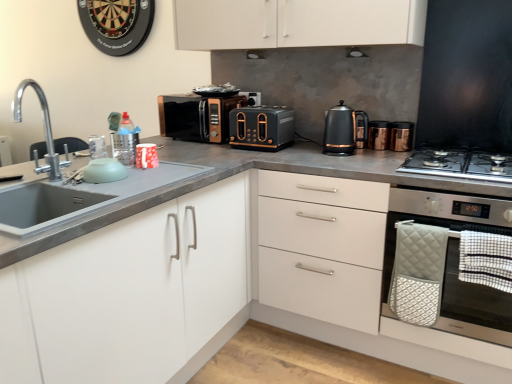
Question: From the image's perspective, would you say chrome metallic faucet at left is shown under white matte cabinet at center, arranged as the 2th cabinetry when viewed from the left?

Choices:
 (A) no
 (B) yes

Answer: (A)

Question: Are chrome metallic faucet at left and white matte cabinet at center, marked as the first cabinetry in a right-to-left arrangement, located far from each other?

Choices:
 (A) no
 (B) yes

Answer: (B)

Question: Is chrome metallic faucet at left taller than white matte cabinet at center, arranged as the 2th cabinetry when viewed from the left?

Choices:
 (A) no
 (B) yes

Answer: (A)

Question: Is chrome metallic faucet at left located outside white matte cabinet at center, arranged as the 2th cabinetry when viewed from the left?

Choices:
 (A) no
 (B) yes

Answer: (B)

Question: Can you confirm if chrome metallic faucet at left is smaller than white matte cabinet at center, marked as the first cabinetry in a right-to-left arrangement?

Choices:
 (A) yes
 (B) no

Answer: (A)

Question: Visually, is stainless steel gas stove at right positioned to the left or to the right of gold metallic canister at upper right, which ranks as the 3th appliance in back-to-front order?

Choices:
 (A) left
 (B) right

Answer: (B)

Question: Which is correct: stainless steel gas stove at right is inside gold metallic canister at upper right, which ranks as the 3th appliance in back-to-front order, or outside of it?

Choices:
 (A) inside
 (B) outside

Answer: (B)

Question: Considering the positions of stainless steel gas stove at right and gold metallic canister at upper right, placed as the second appliance when sorted from bottom to top, in the image, is stainless steel gas stove at right wider or thinner than gold metallic canister at upper right, placed as the second appliance when sorted from bottom to top,?

Choices:
 (A) thin
 (B) wide

Answer: (B)

Question: Considering the positions of stainless steel gas stove at right and gold metallic canister at upper right, placed as the second appliance when sorted from front to back, in the image, is stainless steel gas stove at right bigger or smaller than gold metallic canister at upper right, placed as the second appliance when sorted from front to back,?

Choices:
 (A) big
 (B) small

Answer: (A)

Question: In terms of width, does gold metallic canister at upper right, placed as the second appliance when sorted from front to back, look wider or thinner when compared to black matte exhaust hood at upper center, which is the 1th exhaust hood in back-to-front order?

Choices:
 (A) wide
 (B) thin

Answer: (B)

Question: From the image's perspective, is gold metallic canister at upper right, which is counted as the third appliance, starting from the top, above or below black matte exhaust hood at upper center, acting as the second exhaust hood starting from the front?

Choices:
 (A) above
 (B) below

Answer: (B)

Question: From a real-world perspective, is gold metallic canister at upper right, the fourth appliance when ordered from left to right, positioned above or below black matte exhaust hood at upper center, which is the 1th exhaust hood in back-to-front order?

Choices:
 (A) below
 (B) above

Answer: (A)

Question: Considering the positions of gold metallic canister at upper right, which ranks as the 3th appliance in back-to-front order, and black matte exhaust hood at upper center, the 2th exhaust hood in the right-to-left sequence, in the image, is gold metallic canister at upper right, which ranks as the 3th appliance in back-to-front order, bigger or smaller than black matte exhaust hood at upper center, the 2th exhaust hood in the right-to-left sequence,?

Choices:
 (A) big
 (B) small

Answer: (B)

Question: From their relative heights in the image, would you say black matte toaster at center, arranged as the 4th appliance when viewed from the front, is taller or shorter than black metallic kettle at upper right?

Choices:
 (A) tall
 (B) short

Answer: (B)

Question: From a real-world perspective, is black matte toaster at center, which is counted as the third appliance, starting from the right, positioned above or below black metallic kettle at upper right?

Choices:
 (A) below
 (B) above

Answer: (B)